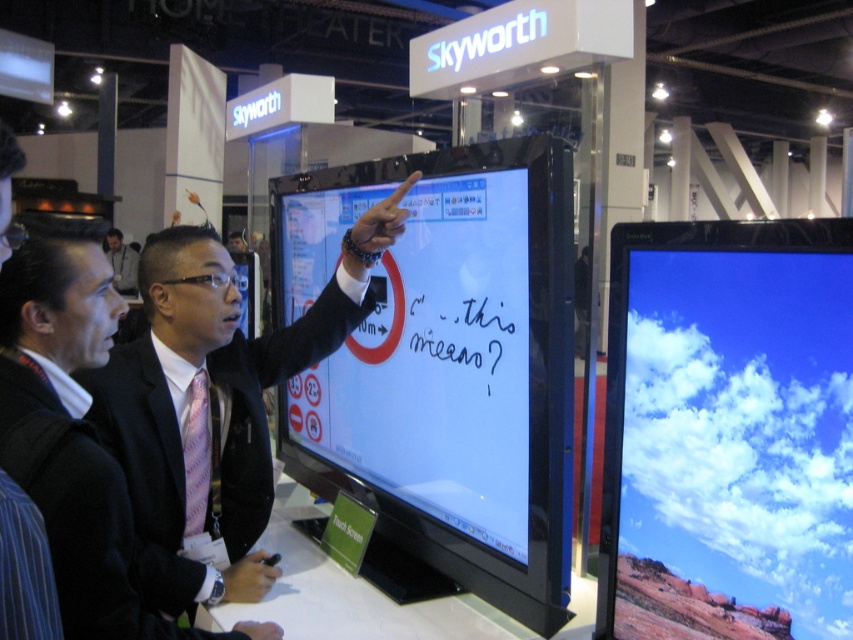
Who is shorter, matte glass monitor at right or pink striped fabric suit at center?

pink striped fabric suit at center

From the picture: Who is more forward, (846, 552) or (137, 632)?

Point (846, 552) is in front.

Which is behind, point (843, 321) or point (108, 483)?

Point (108, 483)

I want to click on matte glass monitor at right, so click(728, 432).

Who is more forward, (x=757, y=358) or (x=274, y=342)?

Positioned in front is point (x=757, y=358).

Can you confirm if matte glass monitor at right is positioned below matte black suit at center?

Indeed, matte glass monitor at right is positioned under matte black suit at center.

At what (x,y) coordinates should I click in order to perform the action: click on matte glass monitor at right. Please return your answer as a coordinate pair (x, y). This screenshot has height=640, width=853. Looking at the image, I should click on (728, 432).

Does matte black suit at center have a lesser width compared to light brown leather jacket at center?

Correct, matte black suit at center's width is less than light brown leather jacket at center's.

How much distance is there between matte black suit at center and light brown leather jacket at center?

They are 6.97 meters apart.

Where is `matte black suit at center`? Image resolution: width=853 pixels, height=640 pixels. matte black suit at center is located at coordinates (215, 397).